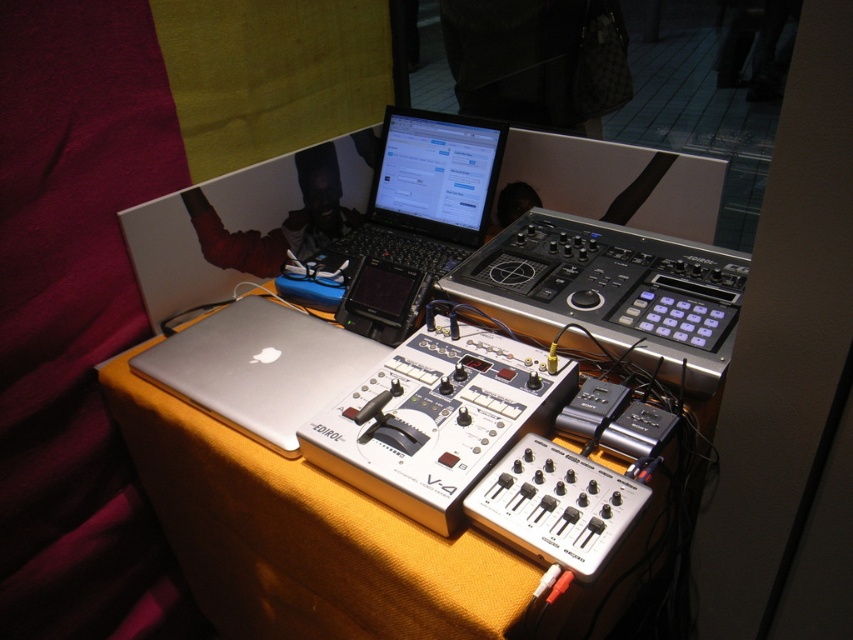
You are an audio technician who needs to place a 13 inch cable between the silver metallic laptop at center and the sleek black laptop at center. Can you fit the cable between them?

The silver metallic laptop at center and sleek black laptop at center are 12.99 inches apart from each other. Since the cable is 13 inches long, it will be just long enough to reach between them.

You are setting up an audio station and need to place a 10 inch wide cable between the black plastic mixer at center and the silver metallic laptop at center. Is there enough space between them to fit the cable without bending it?

The black plastic mixer at center is 12.78 inches away from the silver metallic laptop at center. Since the cable is 10 inches wide, there is enough space to place it between them without bending.

You are setting up audio equipment on a table for a live event. You have a silver metallic mixer at center and a silver metallic laptop at center. Considering the space they occupy, which one should you place first to ensure both fit properly?

You should place the silver metallic mixer at center first since it occupies less space than the silver metallic laptop at center, allowing more room to position the larger laptop afterward.